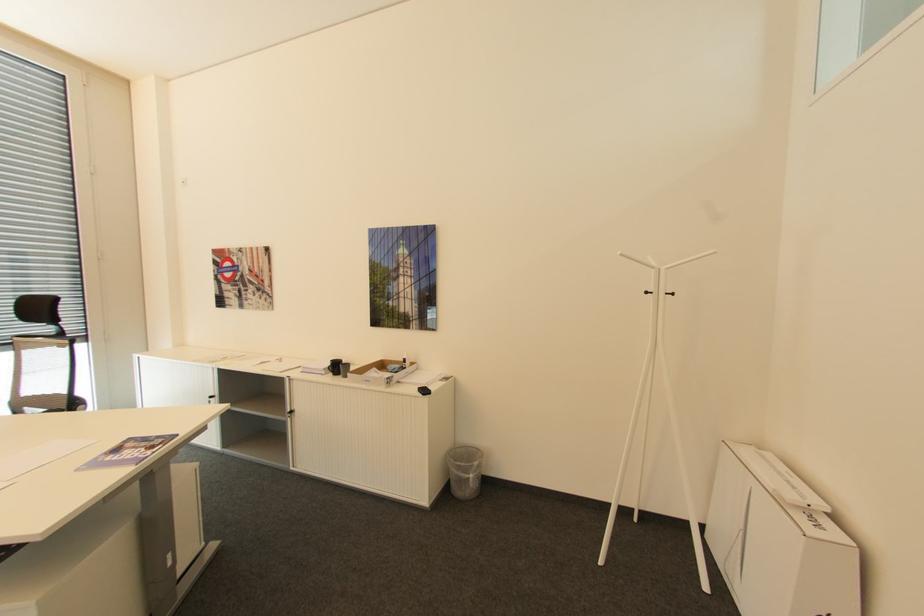
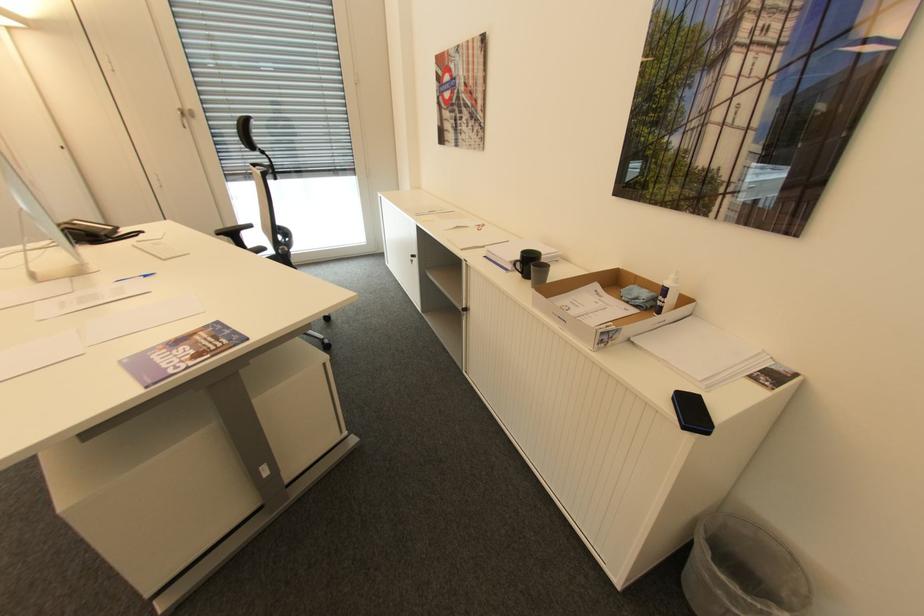
Where in the second image is the point corresponding to (215,397) from the first image?

(418, 256)